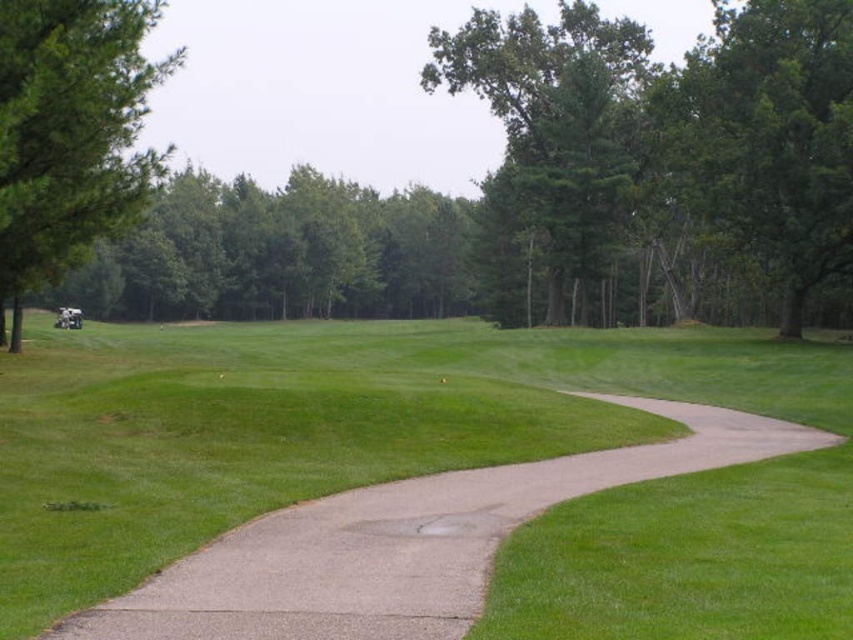
Question: Which point appears closest to the camera in this image?

Choices:
 (A) (622, 35)
 (B) (154, 278)

Answer: (A)

Question: Does green leafy tree at upper center have a larger size compared to green leafy tree at left?

Choices:
 (A) no
 (B) yes

Answer: (A)

Question: Which point is closer to the camera?

Choices:
 (A) green leafy tree at upper center
 (B) green grass at lower left
 (C) green leafy tree at left
 (D) green leafy tree at center

Answer: (B)

Question: Is green grass at lower left positioned before green leafy tree at left?

Choices:
 (A) yes
 (B) no

Answer: (A)

Question: Which of these objects is positioned farthest from the green grass at lower left?

Choices:
 (A) green leafy tree at left
 (B) green leafy tree at upper center
 (C) green leafy tree at center

Answer: (B)

Question: Can you confirm if green grass at lower left is positioned to the right of green leafy tree at center?

Choices:
 (A) yes
 (B) no

Answer: (B)